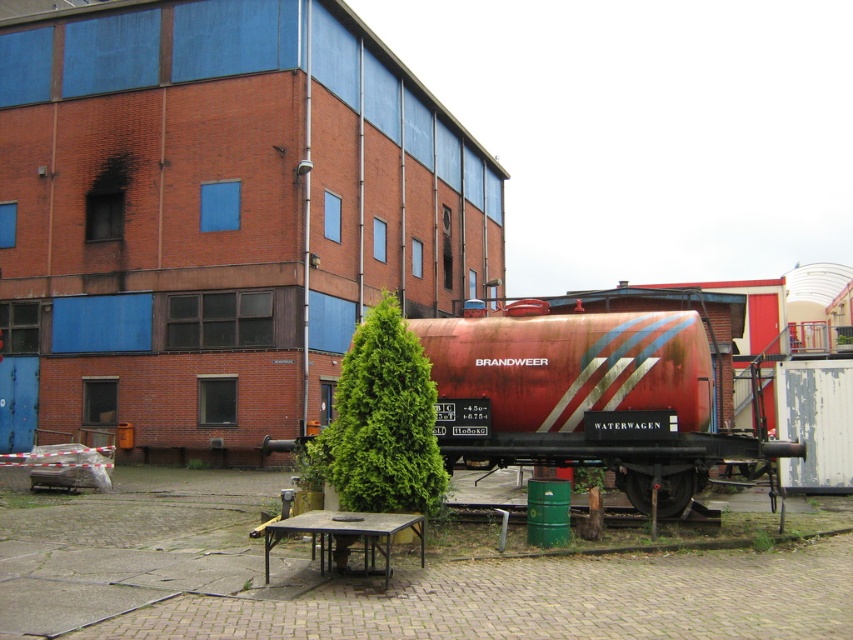
Question: Which object appears farthest from the camera in this image?

Choices:
 (A) wooden picnic table at lower center
 (B) rusty metal tank at center

Answer: (B)

Question: Where is rusty metal tank at center located in relation to wooden picnic table at lower center in the image?

Choices:
 (A) below
 (B) above

Answer: (B)

Question: Which of the following is the closest to the observer?

Choices:
 (A) wooden picnic table at lower center
 (B) rusty metal tank at center

Answer: (A)

Question: Does rusty metal tank at center appear under wooden picnic table at lower center?

Choices:
 (A) yes
 (B) no

Answer: (B)

Question: Is rusty metal tank at center above wooden picnic table at lower center?

Choices:
 (A) yes
 (B) no

Answer: (A)